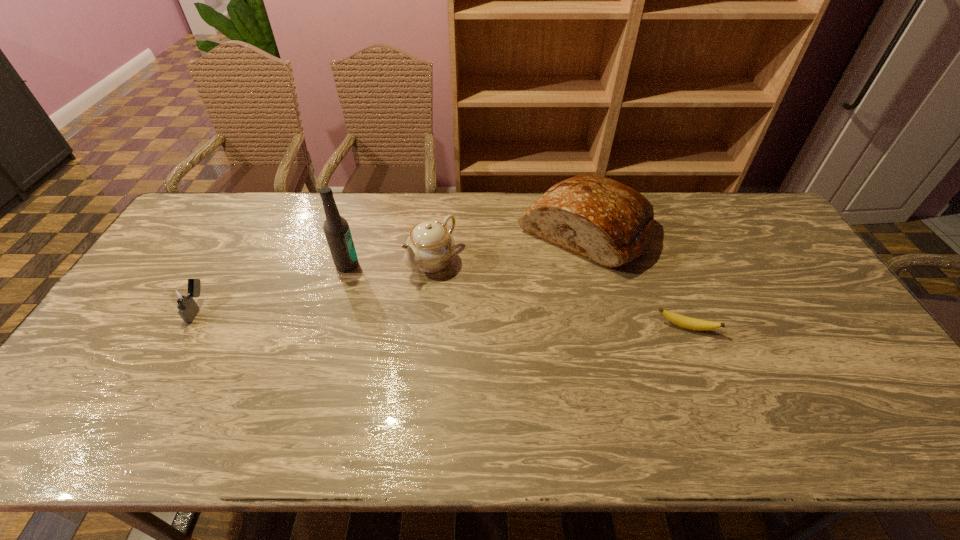
At what (x,y) coordinates should I click in order to perform the action: click on free space at the far edge of the desktop. Please return your answer as a coordinate pair (x, y). This screenshot has width=960, height=540. Looking at the image, I should click on (347, 207).

Where is `free location at the left edge`? free location at the left edge is located at coordinates (185, 275).

Locate an element on the screen. The image size is (960, 540). vacant region at the right edge of the desktop is located at coordinates (820, 332).

The image size is (960, 540). In order to click on vacant point at the far left corner in this screenshot , I will do `click(228, 220)`.

In the image, there is a desktop. Find the location of `vacant space at the far right corner`. vacant space at the far right corner is located at coordinates (765, 219).

Locate an element on the screen. free spot between the banana and the third object from left to right is located at coordinates (560, 294).

I want to click on free space between the banana and the third object from right to left, so click(560, 294).

Locate an element on the screen. This screenshot has height=540, width=960. blank region between the leftmost object and the third object from right to left is located at coordinates [x=315, y=284].

Find the location of a particular element. empty space that is in between the second object from left to right and the bread is located at coordinates click(x=466, y=248).

Find the location of a particular element. The width and height of the screenshot is (960, 540). empty space that is in between the igniter and the third tallest object is located at coordinates (315, 284).